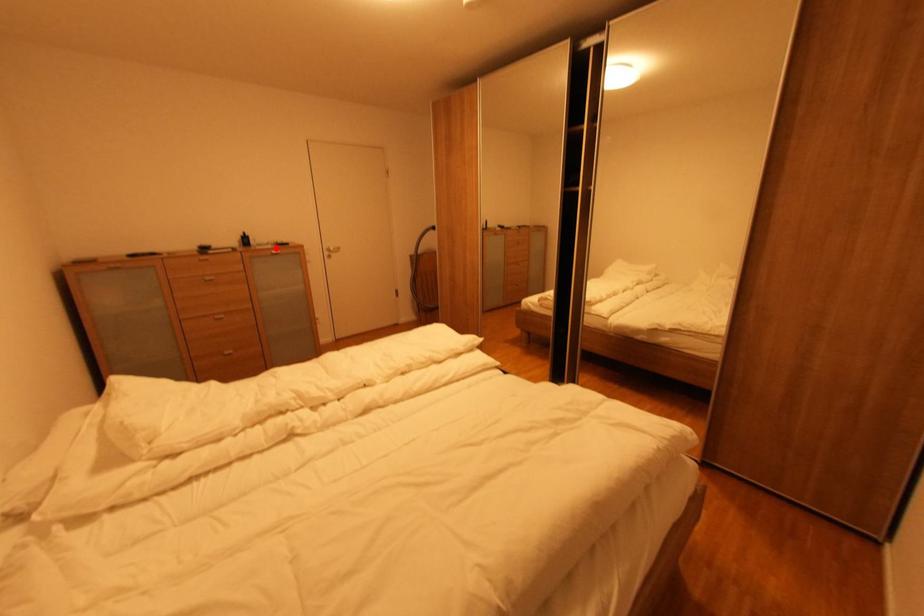
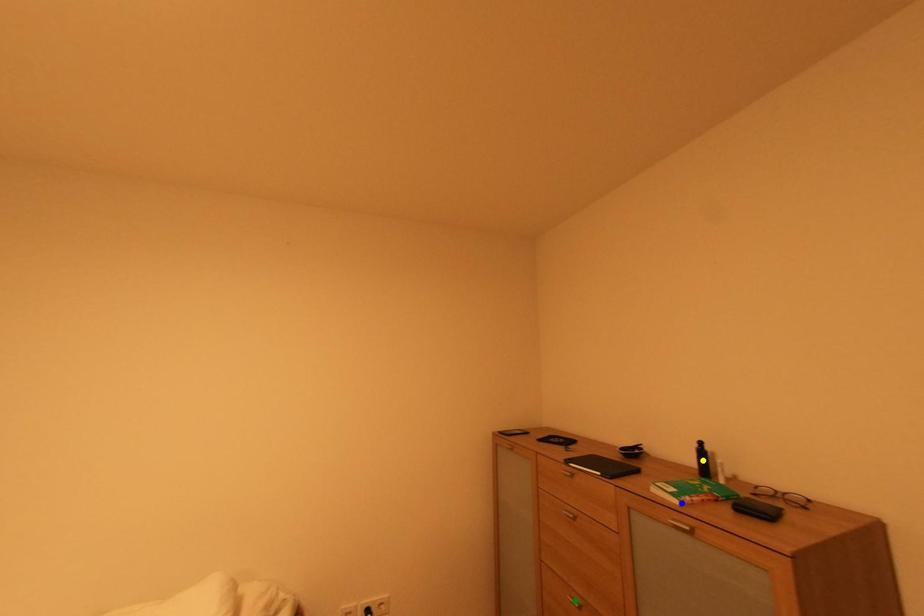
Question: I am providing you with two images of the same scene from different viewpoints. A red point is marked on the first image. You are given multiple points on the second image. Which point in image 2 is actually the same real-world point as the red point in image 1?

Choices:
 (A) blue point
 (B) yellow point
 (C) green point

Answer: (A)